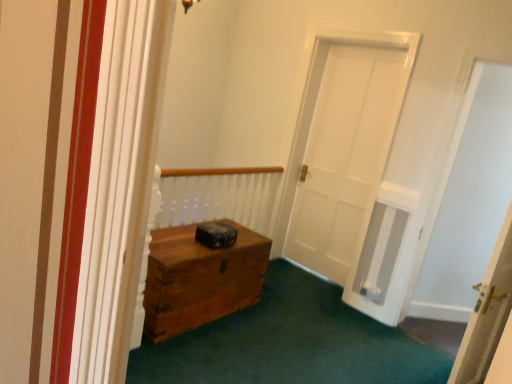
Question: Relative to white matte door at right, is white wooden door at right in front or behind?

Choices:
 (A) front
 (B) behind

Answer: (A)

Question: From a real-world perspective, is white wooden door at right above or below white matte door at right?

Choices:
 (A) above
 (B) below

Answer: (B)

Question: From the image's perspective, is white wooden door at right above or below white matte door at right?

Choices:
 (A) below
 (B) above

Answer: (A)

Question: Based on their sizes in the image, would you say white matte door at right is bigger or smaller than white wooden door at right?

Choices:
 (A) small
 (B) big

Answer: (B)

Question: Would you say white matte door at right is to the left or to the right of white wooden door at right in the picture?

Choices:
 (A) left
 (B) right

Answer: (B)

Question: Is white matte door at right situated inside white wooden door at right or outside?

Choices:
 (A) inside
 (B) outside

Answer: (B)

Question: Considering the positions of white matte door at right and white wooden door at right in the image, is white matte door at right taller or shorter than white wooden door at right?

Choices:
 (A) short
 (B) tall

Answer: (B)